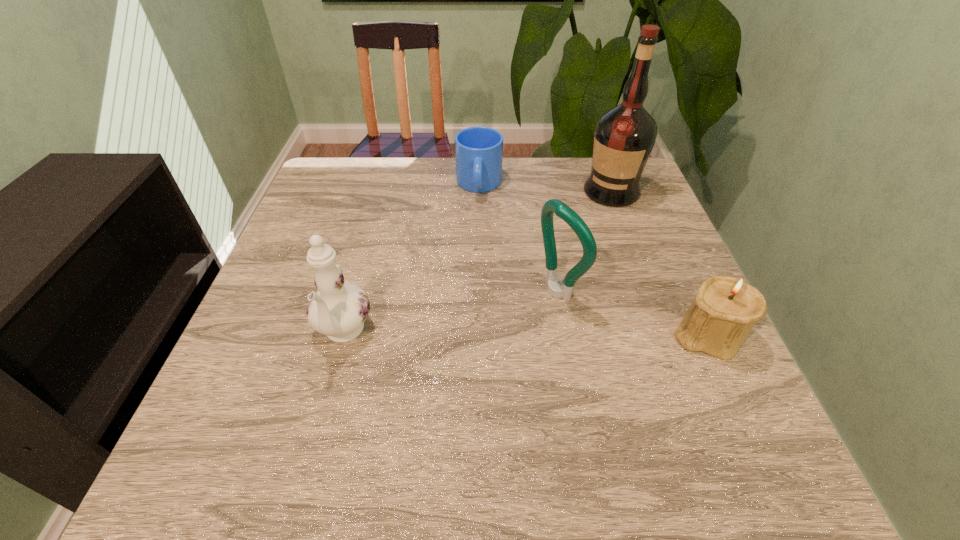
I want to click on chinaware, so click(338, 310).

This screenshot has height=540, width=960. In order to click on the second shortest object in this screenshot , I will do 726,308.

This screenshot has height=540, width=960. I want to click on the tallest object, so click(x=624, y=136).

Where is `the second object from left to right`? The width and height of the screenshot is (960, 540). the second object from left to right is located at coordinates (478, 150).

Find the location of a particular element. The width and height of the screenshot is (960, 540). the shortest object is located at coordinates (478, 150).

I want to click on bottle opener, so click(x=555, y=288).

At what (x,y) coordinates should I click in order to perform the action: click on vacant space located 0.250m on the back of the candle_holder. Please return your answer as a coordinate pair (x, y). Looking at the image, I should click on (660, 233).

Find the location of a particular element. free space located 0.330m on the surface of the tallest object is located at coordinates click(551, 283).

Find the location of a particular element. The width and height of the screenshot is (960, 540). vacant space located 0.260m on the surface of the tallest object is located at coordinates (564, 264).

You are a GUI agent. You are given a task and a screenshot of the screen. Output one action in this format:
    pyautogui.click(x=<x>, y=<y>)
    Task: Click on the free space located 0.240m on the surface of the tallest object
    This screenshot has height=540, width=960.
    Given the screenshot: What is the action you would take?
    pyautogui.click(x=567, y=259)